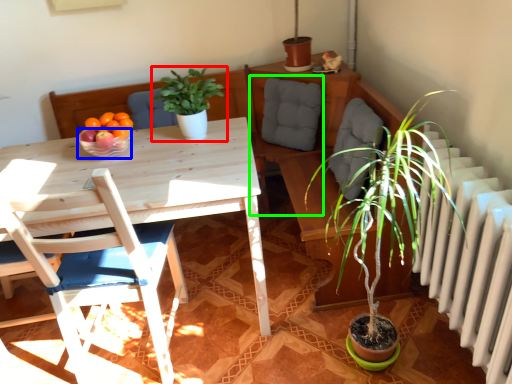
Question: Which object is positioned closest to houseplant (highlighted by a red box)? Select from bowl (highlighted by a blue box) and swivel chair (highlighted by a green box).

Choices:
 (A) bowl
 (B) swivel chair

Answer: (A)